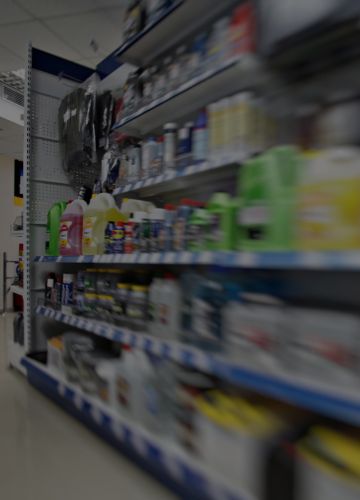
Identify the location of bottom shelf. (148, 442).